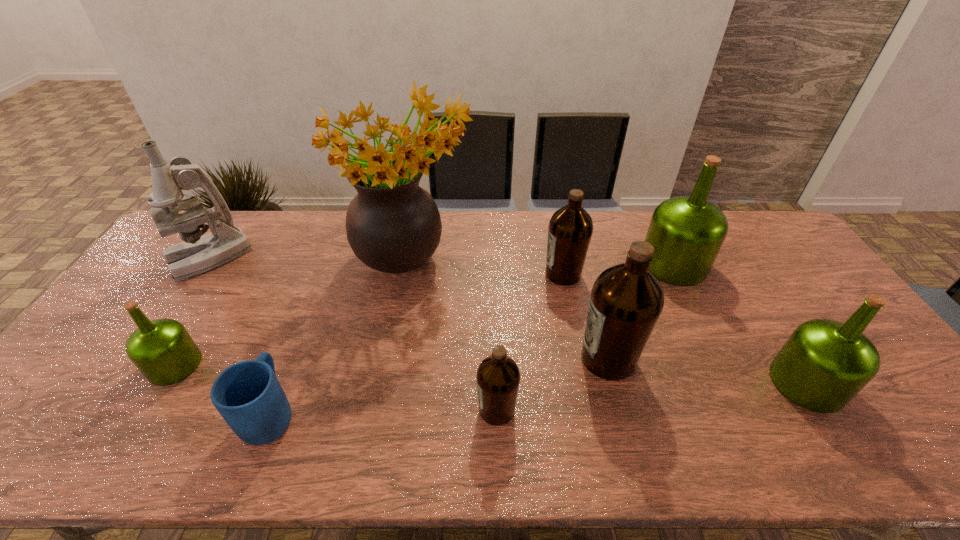
This screenshot has width=960, height=540. Identify the location of free space located on the label of the second biggest brown olive oil. (492, 274).

The width and height of the screenshot is (960, 540). In order to click on free space located 0.070m on the label of the second biggest brown olive oil in this screenshot , I will do `click(520, 274)`.

Where is `vacant space located 0.050m on the label of the second biggest brown olive oil`? The height and width of the screenshot is (540, 960). vacant space located 0.050m on the label of the second biggest brown olive oil is located at coordinates (527, 274).

Locate an element on the screen. The image size is (960, 540). free spot located on the back of the leftmost green olive oil is located at coordinates (221, 291).

Where is `vacant space located on the label of the leftmost brown olive oil`? The height and width of the screenshot is (540, 960). vacant space located on the label of the leftmost brown olive oil is located at coordinates (359, 410).

Locate an element on the screen. The height and width of the screenshot is (540, 960). blank area located on the label of the leftmost brown olive oil is located at coordinates (329, 410).

Locate an element on the screen. This screenshot has width=960, height=540. vacant area situated 0.350m on the label of the leftmost brown olive oil is located at coordinates (329, 410).

You are a GUI agent. You are given a task and a screenshot of the screen. Output one action in this format:
    pyautogui.click(x=<x>, y=<y>)
    Task: Click on the blank space located on the side of the seventh object from right to left with the handle
    This screenshot has width=960, height=540.
    Given the screenshot: What is the action you would take?
    pyautogui.click(x=302, y=330)

Identify the location of blank space located 0.160m on the side of the seventh object from right to left with the handle. (301, 333).

At what (x,y) coordinates should I click in order to perform the action: click on vacant space located on the side of the seventh object from right to left with the handle. Please return your answer as a coordinate pair (x, y). This screenshot has height=540, width=960. Looking at the image, I should click on (324, 276).